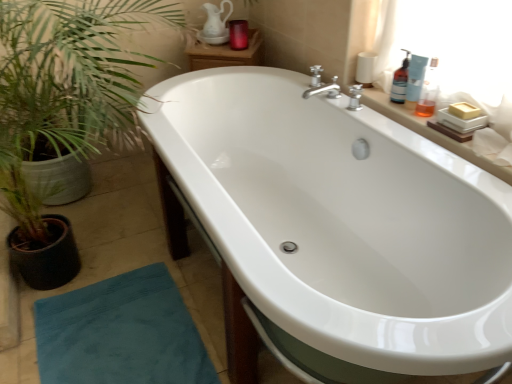
This screenshot has width=512, height=384. What do you see at coordinates (342, 224) in the screenshot? I see `white glossy bathtub at center` at bounding box center [342, 224].

The height and width of the screenshot is (384, 512). What do you see at coordinates (400, 81) in the screenshot? I see `translucent plastic bottle at upper right, which appears as the third toiletry when viewed from the right` at bounding box center [400, 81].

Where is `blue plastic bottle at upper right, the 4th toiletry from the back`? Image resolution: width=512 pixels, height=384 pixels. blue plastic bottle at upper right, the 4th toiletry from the back is located at coordinates (429, 91).

Measure the distance between translucent plastic bottle at upper right, placed as the 3th toiletry when sorted from left to right, and camera.

A distance of 4.72 feet exists between translucent plastic bottle at upper right, placed as the 3th toiletry when sorted from left to right, and camera.

Identify the location of white glossy bathtub at center. (342, 224).

Considering the relative positions of blue plastic bottle at upper right, the 4th toiletry from the back, and teal fabric doormat at lower left in the image provided, is blue plastic bottle at upper right, the 4th toiletry from the back, to the left of teal fabric doormat at lower left from the viewer's perspective?

Incorrect, blue plastic bottle at upper right, the 4th toiletry from the back, is not on the left side of teal fabric doormat at lower left.

This screenshot has width=512, height=384. In the image, there is a blue plastic bottle at upper right, arranged as the fourth toiletry when viewed from the left. Find the location of `doormat below it (from a real-world perspective)`. doormat below it (from a real-world perspective) is located at coordinates (121, 333).

Considering the relative sizes of blue plastic bottle at upper right, arranged as the first toiletry when viewed from the right, and teal fabric doormat at lower left in the image provided, is blue plastic bottle at upper right, arranged as the first toiletry when viewed from the right, shorter than teal fabric doormat at lower left?

In fact, blue plastic bottle at upper right, arranged as the first toiletry when viewed from the right, may be taller than teal fabric doormat at lower left.

Is translucent plastic bottle at upper right, the 3th toiletry from the back, in front of or behind teal fabric doormat at lower left in the image?

In the image, translucent plastic bottle at upper right, the 3th toiletry from the back, appears behind teal fabric doormat at lower left.

What's the angular difference between translucent plastic bottle at upper right, the 2th toiletry from the front, and teal fabric doormat at lower left's facing directions?

13 degrees.

Considering the sizes of translucent plastic bottle at upper right, placed as the 3th toiletry when sorted from left to right, and teal fabric doormat at lower left in the image, is translucent plastic bottle at upper right, placed as the 3th toiletry when sorted from left to right, taller or shorter than teal fabric doormat at lower left?

Clearly, translucent plastic bottle at upper right, placed as the 3th toiletry when sorted from left to right, is taller compared to teal fabric doormat at lower left.

Does teal fabric doormat at lower left appear on the right side of matte glass candle at upper center, the 4th toiletry viewed from the front?

No.

Considering the positions of objects teal fabric doormat at lower left and matte glass candle at upper center, the first toiletry in the back-to-front sequence, in the image provided, who is in front, teal fabric doormat at lower left or matte glass candle at upper center, the first toiletry in the back-to-front sequence,?

teal fabric doormat at lower left is in front.

From a real-world perspective, which is physically above, teal fabric doormat at lower left or matte glass candle at upper center, acting as the 1th toiletry starting from the left?

matte glass candle at upper center, acting as the 1th toiletry starting from the left.

Looking at this image, would you say teal fabric doormat at lower left is outside matte glass candle at upper center, the 4th toiletry viewed from the front?

Indeed, teal fabric doormat at lower left is completely outside matte glass candle at upper center, the 4th toiletry viewed from the front.

Consider the image. Between white glossy bathtub at center and white ceramic soap at upper right, which one has larger width?

white glossy bathtub at center is wider.

Who is smaller, white glossy bathtub at center or white ceramic soap at upper right?

white ceramic soap at upper right is smaller.

Choose the correct answer: Is white glossy bathtub at center inside white ceramic soap at upper right or outside it?

white glossy bathtub at center cannot be found inside white ceramic soap at upper right.

Can you see white glossy bathtub at center touching white ceramic soap at upper right?

No, white glossy bathtub at center is not making contact with white ceramic soap at upper right.

I want to click on toiletry in front of the translucent plastic bottle at upper right, placed as the 3th toiletry when sorted from left to right, so click(x=429, y=91).

Is blue plastic bottle at upper right, arranged as the fourth toiletry when viewed from the left, completely or partially inside translucent plastic bottle at upper right, which is counted as the 2th toiletry, starting from the right?

No, blue plastic bottle at upper right, arranged as the fourth toiletry when viewed from the left, is located outside of translucent plastic bottle at upper right, which is counted as the 2th toiletry, starting from the right.

Considering the positions of points (421, 70) and (433, 107), is point (421, 70) farther from camera compared to point (433, 107)?

No.

Which object is thinner, translucent plastic bottle at upper right, placed as the 3th toiletry when sorted from left to right, or blue plastic bottle at upper right, the 4th toiletry from the back?

translucent plastic bottle at upper right, placed as the 3th toiletry when sorted from left to right.

From the image's perspective, between white ceramic soap at upper right and white glossy bathtub at center, which one is located above?

From the image's view, white ceramic soap at upper right is above.

Image resolution: width=512 pixels, height=384 pixels. Find the location of `counter top that appears above the white glossy bathtub at center (from the image's perspective)`. counter top that appears above the white glossy bathtub at center (from the image's perspective) is located at coordinates (430, 132).

Between white ceramic soap at upper right and white glossy bathtub at center, which one has larger width?

white glossy bathtub at center is wider.

Considering the relative sizes of white ceramic soap at upper right and white glossy bathtub at center in the image provided, is white ceramic soap at upper right bigger than white glossy bathtub at center?

Actually, white ceramic soap at upper right might be smaller than white glossy bathtub at center.

Does teal fabric doormat at lower left have a larger size compared to translucent plastic bottle at upper right, which is counted as the 2th toiletry, starting from the right?

Yes, teal fabric doormat at lower left is bigger than translucent plastic bottle at upper right, which is counted as the 2th toiletry, starting from the right.

Is the depth of teal fabric doormat at lower left less than that of translucent plastic bottle at upper right, the 3th toiletry from the back?

Yes, it is in front of translucent plastic bottle at upper right, the 3th toiletry from the back.

Between teal fabric doormat at lower left and translucent plastic bottle at upper right, the 3th toiletry from the back, which one has more height?

translucent plastic bottle at upper right, the 3th toiletry from the back, is taller.

In the scene shown: Can you tell me how much teal fabric doormat at lower left and translucent plastic bottle at upper right, the 2th toiletry from the front, differ in facing direction?

teal fabric doormat at lower left and translucent plastic bottle at upper right, the 2th toiletry from the front, are facing 13 degrees away from each other.

Where is `doormat that appears below the blue plastic bottle at upper right, arranged as the fourth toiletry when viewed from the left (from a real-world perspective)`? doormat that appears below the blue plastic bottle at upper right, arranged as the fourth toiletry when viewed from the left (from a real-world perspective) is located at coordinates click(121, 333).

The width and height of the screenshot is (512, 384). In order to click on the 2nd toiletry behind the teal fabric doormat at lower left in this screenshot , I will do `click(415, 79)`.

When comparing their distances from translucent plastic bottle at upper right, the third toiletry from the front, does white glossy bathtub at center or translucent plastic bottle at upper right, which is counted as the 2th toiletry, starting from the right, seem further?

Based on the image, white glossy bathtub at center appears to be further to translucent plastic bottle at upper right, the third toiletry from the front.

Which object lies further to the anchor point translucent plastic bottle at upper right, which appears as the third toiletry when viewed from the right, translucent plastic bottle at upper right, which is counted as the 2th toiletry, starting from the right, or blue plastic bottle at upper right, arranged as the fourth toiletry when viewed from the left?

The object further to translucent plastic bottle at upper right, which appears as the third toiletry when viewed from the right, is blue plastic bottle at upper right, arranged as the fourth toiletry when viewed from the left.

Looking at the image, which one is located closer to white ceramic soap at upper right, teal fabric doormat at lower left or translucent plastic bottle at upper right, the 3th toiletry from the back?

translucent plastic bottle at upper right, the 3th toiletry from the back, is closer to white ceramic soap at upper right.

Looking at the image, which one is located further to translucent plastic bottle at upper right, which is the second toiletry in left-to-right order, matte glass candle at upper center, the 4th toiletry viewed from the front, or white ceramic soap at upper right?

The object further to translucent plastic bottle at upper right, which is the second toiletry in left-to-right order, is matte glass candle at upper center, the 4th toiletry viewed from the front.

Based on their spatial positions, is matte glass candle at upper center, marked as the 4th toiletry in a right-to-left arrangement, or teal fabric doormat at lower left closer to translucent plastic bottle at upper right, which is the second toiletry in left-to-right order?

matte glass candle at upper center, marked as the 4th toiletry in a right-to-left arrangement, is closer to translucent plastic bottle at upper right, which is the second toiletry in left-to-right order.

Estimate the real-world distances between objects in this image. Which object is further from teal fabric doormat at lower left, translucent plastic bottle at upper right, which appears as the third toiletry when viewed from the right, or white glossy bathtub at center?

Among the two, translucent plastic bottle at upper right, which appears as the third toiletry when viewed from the right, is located further to teal fabric doormat at lower left.

Based on their spatial positions, is white glossy bathtub at center or teal fabric doormat at lower left further from translucent plastic bottle at upper right, the 2th toiletry from the front?

teal fabric doormat at lower left.

Looking at the image, which one is located further to matte glass candle at upper center, the 4th toiletry viewed from the front, translucent plastic bottle at upper right, the 3th toiletry from the back, or translucent plastic bottle at upper right, which appears as the third toiletry when viewed from the right?

The object further to matte glass candle at upper center, the 4th toiletry viewed from the front, is translucent plastic bottle at upper right, the 3th toiletry from the back.

Image resolution: width=512 pixels, height=384 pixels. In order to click on doormat between white glossy bathtub at center and matte glass candle at upper center, marked as the 4th toiletry in a right-to-left arrangement, along the z-axis in this screenshot , I will do `click(121, 333)`.

I want to click on bathtub between teal fabric doormat at lower left and white ceramic soap at upper right from left to right, so click(x=342, y=224).

Locate an element on the screen. Image resolution: width=512 pixels, height=384 pixels. toiletry positioned between white glossy bathtub at center and translucent plastic bottle at upper right, the 3th toiletry from the back, from near to far is located at coordinates (429, 91).

This screenshot has height=384, width=512. What are the coordinates of `counter top positioned between white glossy bathtub at center and matte glass candle at upper center, the first toiletry in the back-to-front sequence, from near to far` in the screenshot? It's located at (430, 132).